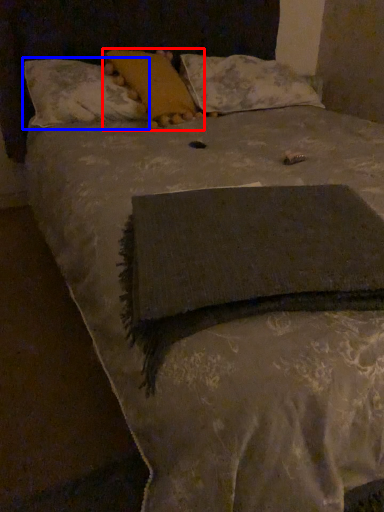
Question: Among these objects, which one is farthest to the camera, pillow (highlighted by a red box) or pillow (highlighted by a blue box)?

Choices:
 (A) pillow
 (B) pillow

Answer: (A)